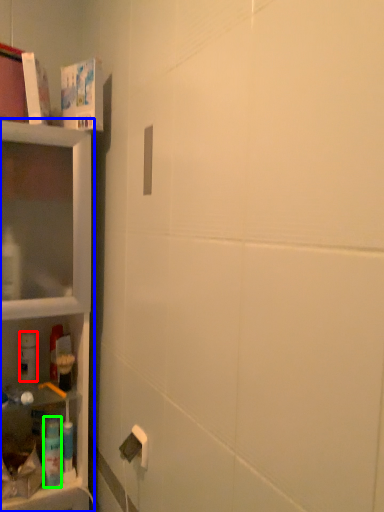
Question: Which is farther away from cleaning product (highlighted by a red box)? shelf (highlighted by a blue box) or cleaning product (highlighted by a green box)?

Choices:
 (A) shelf
 (B) cleaning product

Answer: (A)